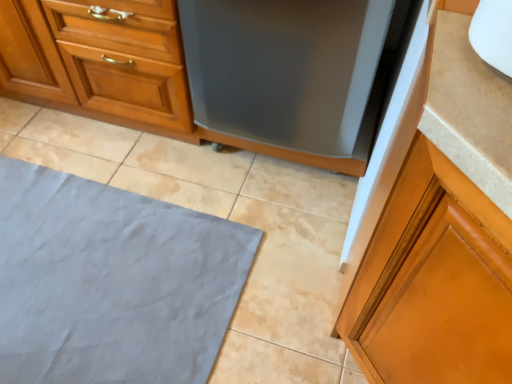
Question: Is wooden cabinet at center, arranged as the 2th cabinetry when viewed from the right, at the right side of glossy wood cabinet at right, the second cabinetry from the back?

Choices:
 (A) no
 (B) yes

Answer: (A)

Question: From the image's perspective, is wooden cabinet at center, acting as the first cabinetry starting from the top, located above glossy wood cabinet at right, the 1th cabinetry positioned from the bottom?

Choices:
 (A) yes
 (B) no

Answer: (A)

Question: Is wooden cabinet at center, the 2th cabinetry from the front, facing towards glossy wood cabinet at right, positioned as the 1th cabinetry in right-to-left order?

Choices:
 (A) no
 (B) yes

Answer: (A)

Question: Is wooden cabinet at center, the second cabinetry when ordered from bottom to top, turned away from glossy wood cabinet at right, the second cabinetry from the back?

Choices:
 (A) yes
 (B) no

Answer: (B)

Question: From the image's perspective, does wooden cabinet at center, acting as the first cabinetry starting from the top, appear lower than glossy wood cabinet at right, placed as the 2th cabinetry when sorted from top to bottom?

Choices:
 (A) no
 (B) yes

Answer: (A)

Question: From a real-world perspective, is wooden cabinet at center, the 2th cabinetry from the front, positioned above or below satin black dishwasher at center?

Choices:
 (A) above
 (B) below

Answer: (B)

Question: Visually, is wooden cabinet at center, which appears as the 1th cabinetry when viewed from the left, positioned to the left or to the right of satin black dishwasher at center?

Choices:
 (A) right
 (B) left

Answer: (B)

Question: From the image's perspective, is wooden cabinet at center, which appears as the 1th cabinetry when viewed from the left, located above or below satin black dishwasher at center?

Choices:
 (A) below
 (B) above

Answer: (B)

Question: Is wooden cabinet at center, the second cabinetry when ordered from bottom to top, taller or shorter than satin black dishwasher at center?

Choices:
 (A) short
 (B) tall

Answer: (A)

Question: Do you think wooden cabinet at center, which appears as the 1th cabinetry when viewed from the left, is within gray fabric bath mat at lower left, or outside of it?

Choices:
 (A) inside
 (B) outside

Answer: (B)

Question: Does point (168, 1) appear closer or farther from the camera than point (3, 173)?

Choices:
 (A) closer
 (B) farther

Answer: (A)

Question: Would you say wooden cabinet at center, acting as the first cabinetry starting from the top, is to the left or to the right of gray fabric bath mat at lower left in the picture?

Choices:
 (A) left
 (B) right

Answer: (A)

Question: From the image's perspective, relative to gray fabric bath mat at lower left, is wooden cabinet at center, arranged as the 2th cabinetry when viewed from the right, above or below?

Choices:
 (A) below
 (B) above

Answer: (B)

Question: Is point (111, 382) positioned closer to the camera than point (284, 77)?

Choices:
 (A) farther
 (B) closer

Answer: (B)

Question: Is gray fabric bath mat at lower left situated inside satin black dishwasher at center or outside?

Choices:
 (A) outside
 (B) inside

Answer: (A)